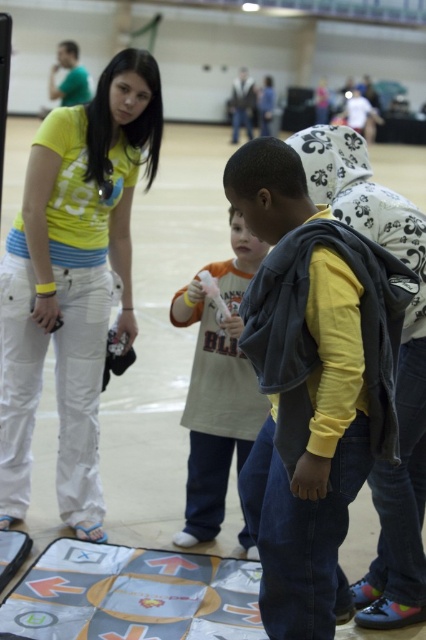
You are standing at the entrance of the gymnasium and see the gray fabric mat at lower center and the orange cotton shirt at center. Which object is closer to you?

The gray fabric mat at lower center is closer to you because it is in front of the orange cotton shirt at center.

You are standing at the entrance of the gymnasium and want to locate the person wearing the dark gray fleece vest at center. According to the coordinates provided, where should you look to find them?

The dark gray fleece vest at center is located at coordinates point (313, 465), so you should look towards the lower right area of the image.